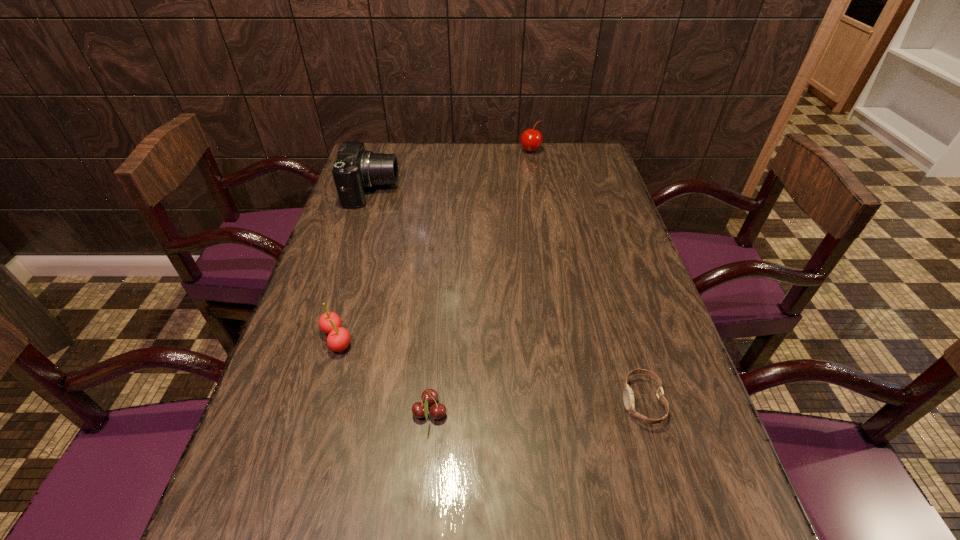
Where is `free point that satisfies the following two spatial constraints: 1. on the lens of the third nearest object; 2. on the left side of the tallest object`? The width and height of the screenshot is (960, 540). free point that satisfies the following two spatial constraints: 1. on the lens of the third nearest object; 2. on the left side of the tallest object is located at coordinates (324, 339).

Image resolution: width=960 pixels, height=540 pixels. Find the location of `free location that satisfies the following two spatial constraints: 1. on the front side of the second object from right to left; 2. on the leaves of the nearest cherry`. free location that satisfies the following two spatial constraints: 1. on the front side of the second object from right to left; 2. on the leaves of the nearest cherry is located at coordinates (574, 412).

What are the coordinates of `free space that satisfies the following two spatial constraints: 1. on the lens of the third tallest object; 2. on the right side of the fourth nearest object` in the screenshot? It's located at pyautogui.click(x=324, y=339).